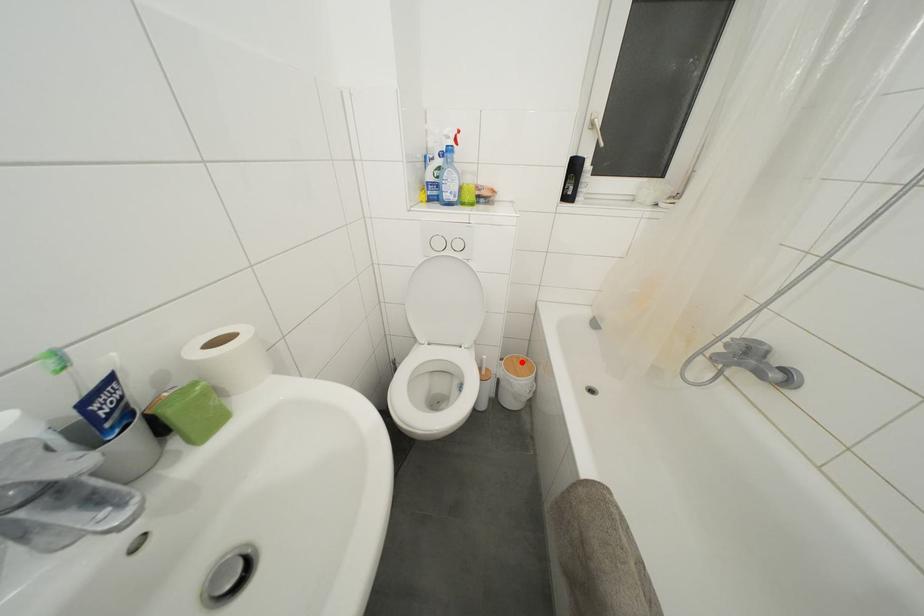
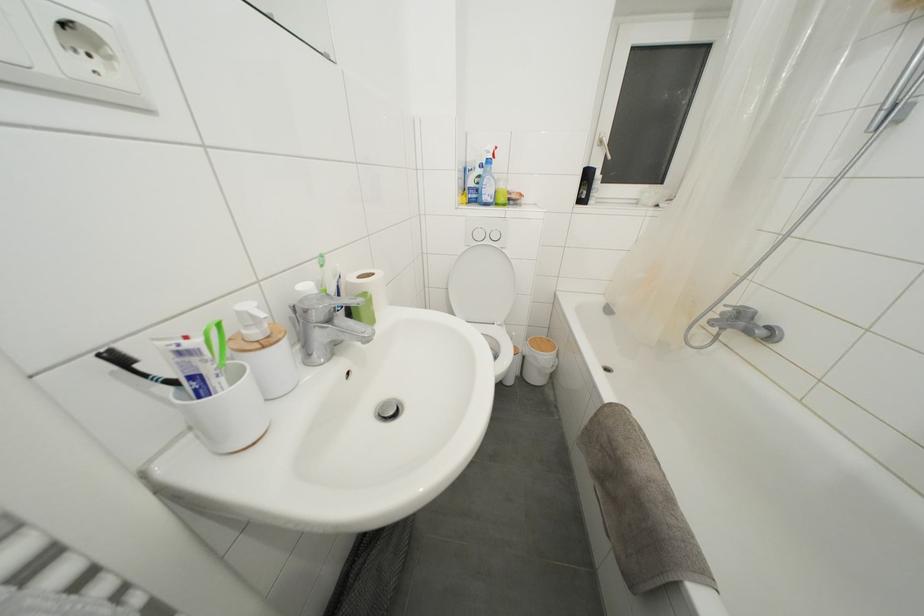
Question: I am providing you with two images of the same scene from different viewpoints. A red point is shown in image1. For the corresponding object point in image2, is it positioned nearer or farther from the camera?

Choices:
 (A) Nearer
 (B) Farther

Answer: (A)